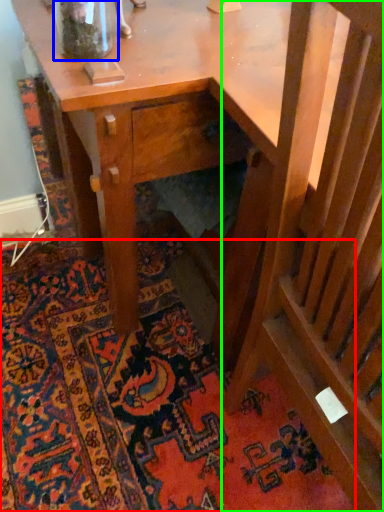
Question: Which object is positioned closest to mat (highlighted by a red box)? Select from glass vase (highlighted by a blue box) and rocking chair (highlighted by a green box).

Choices:
 (A) glass vase
 (B) rocking chair

Answer: (B)